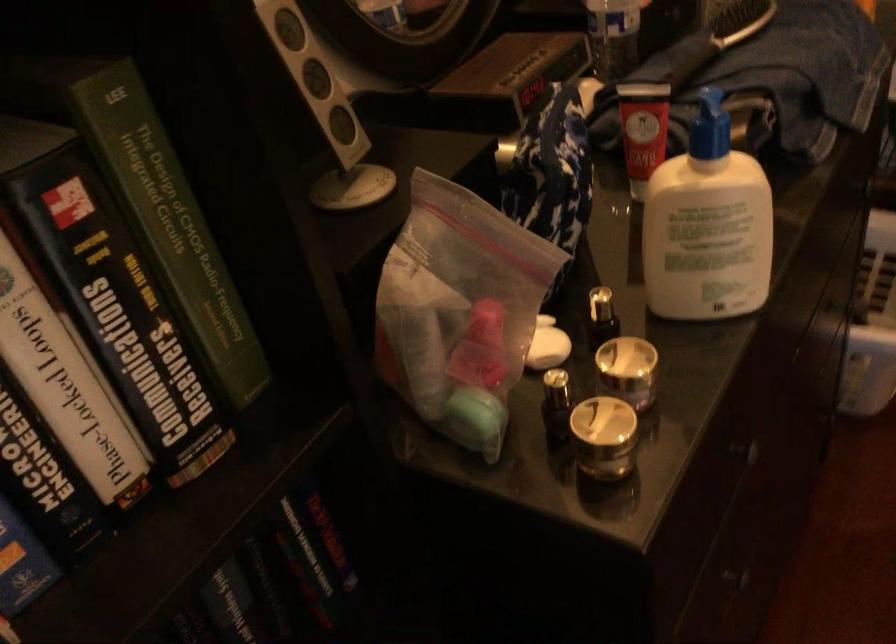
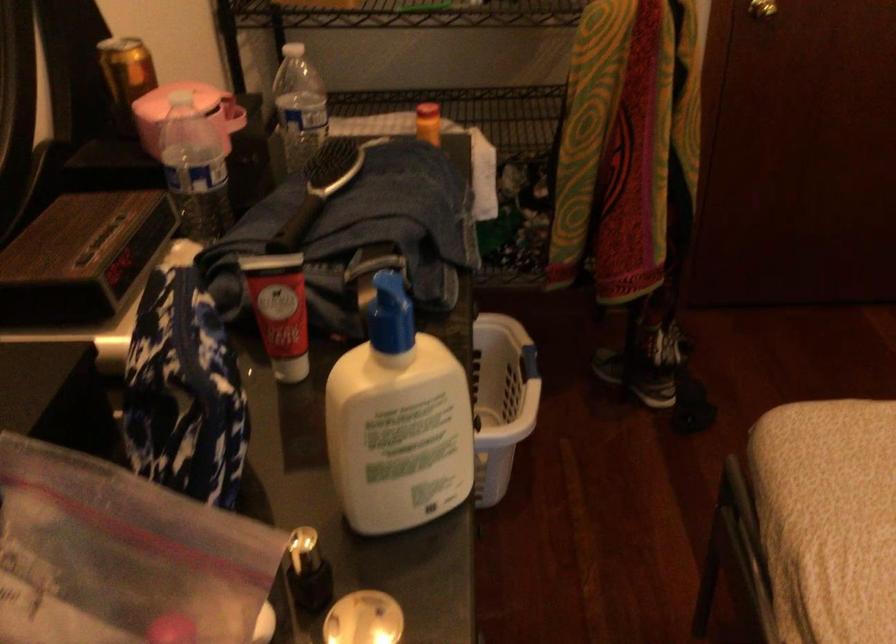
Find the pixel in the second image that matches pixel 707 114 in the first image.

(391, 314)